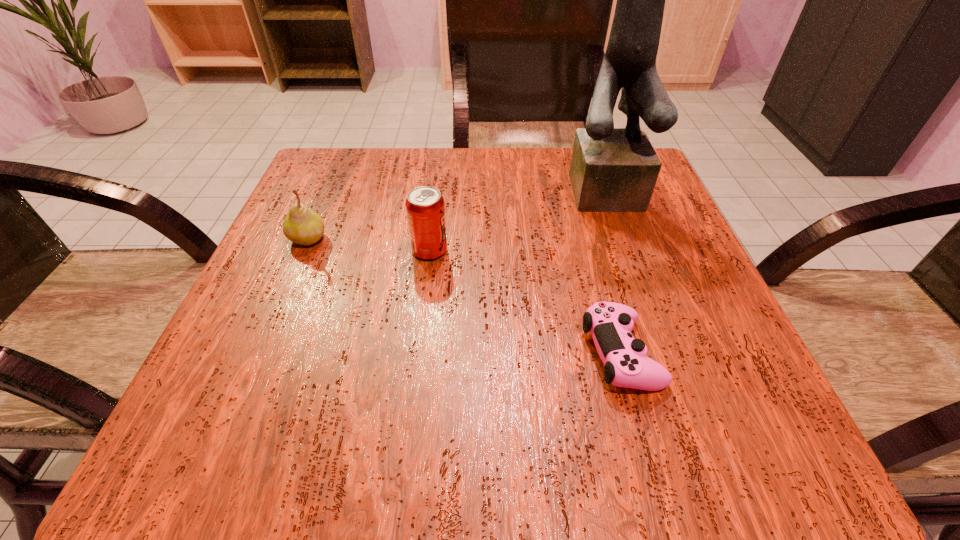
Where is `sculpture`? sculpture is located at coordinates (612, 170).

Image resolution: width=960 pixels, height=540 pixels. Identify the location of the tallest object. (612, 170).

I want to click on the third object from right to left, so click(425, 209).

The width and height of the screenshot is (960, 540). I want to click on pear, so click(x=301, y=225).

Locate an element on the screen. the nearest object is located at coordinates (610, 324).

This screenshot has height=540, width=960. Identify the location of the shortest object. (610, 324).

The height and width of the screenshot is (540, 960). Identify the location of blank space located on the face of the farthest object. (631, 233).

Image resolution: width=960 pixels, height=540 pixels. Find the location of `vacant region located on the right of the second object from left to right`. vacant region located on the right of the second object from left to right is located at coordinates (567, 251).

Find the location of a particular element. The height and width of the screenshot is (540, 960). free spot located on the right of the pear is located at coordinates (486, 239).

Image resolution: width=960 pixels, height=540 pixels. I want to click on free point located 0.390m on the back of the shortest object, so click(574, 180).